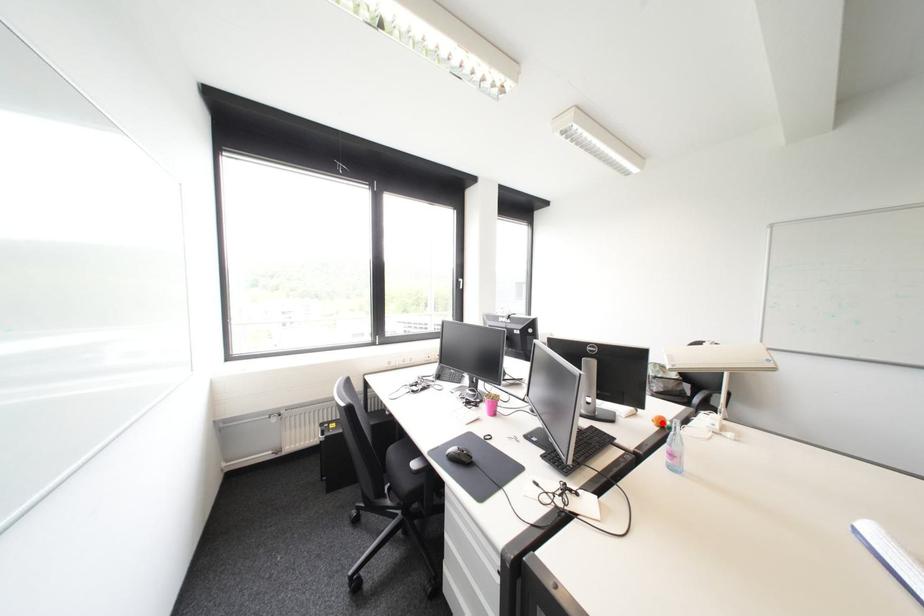
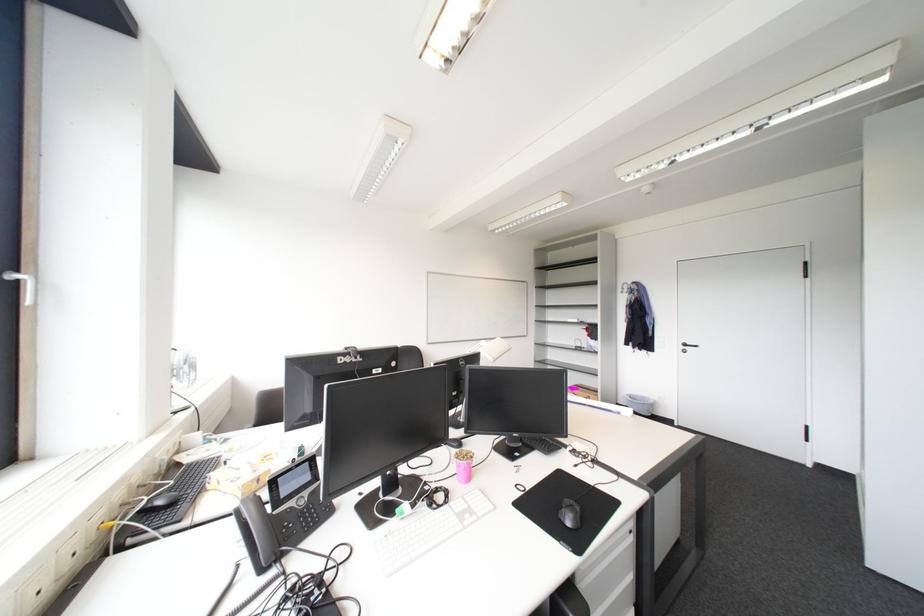
Question: I am providing you with two images of the same scene from different viewpoints. A red point is marked on the first image. At the location where the point appears in image 1, is it still visible in image 2?

Choices:
 (A) Yes
 (B) No

Answer: (B)